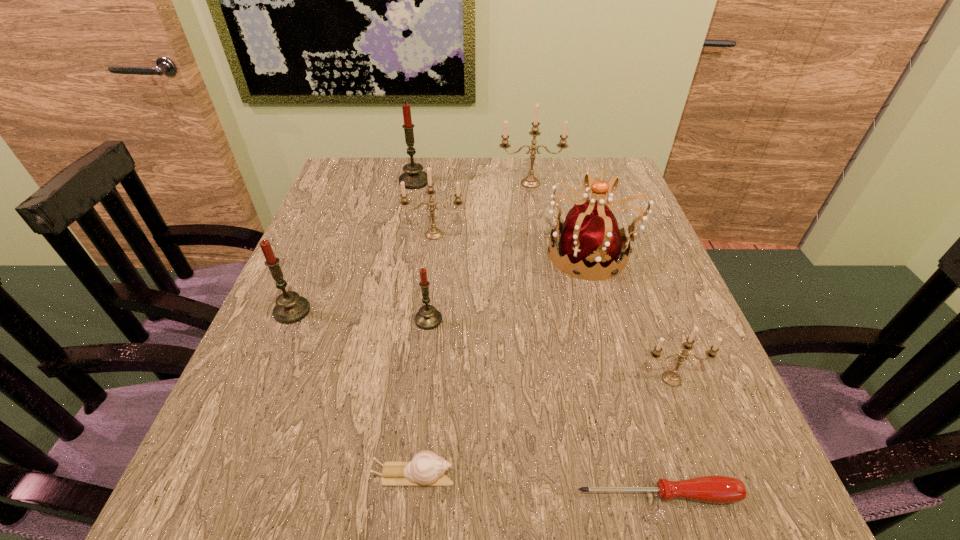
The height and width of the screenshot is (540, 960). In order to click on vacant point located between the seventh farthest object and the second nearest metallic candle in this screenshot , I will do `click(553, 307)`.

Find the location of a particular element. free space between the leftmost red candle and the rightmost candle is located at coordinates (482, 345).

The height and width of the screenshot is (540, 960). What are the coordinates of `vacant region between the shortest object and the nearest candle` in the screenshot? It's located at (664, 437).

Locate an element on the screen. vacant space that's between the screwdriver and the smallest metallic candle is located at coordinates (664, 437).

Find the location of a particular element. unoccupied position between the second farthest metallic candle and the red tiara is located at coordinates (513, 244).

The height and width of the screenshot is (540, 960). What are the coordinates of `free space between the rightmost red candle and the second red candle from right to left` in the screenshot? It's located at (421, 251).

Locate an element on the screen. This screenshot has height=540, width=960. free space between the leftmost red candle and the smallest red candle is located at coordinates (360, 315).

This screenshot has height=540, width=960. Identify the location of blank region between the biggest metallic candle and the biggest red candle. (472, 183).

The width and height of the screenshot is (960, 540). What are the coordinates of `vacant area that lies between the second smallest red candle and the red tiara` in the screenshot? It's located at (442, 282).

Where is `vacant space in between the escargot and the nearest metallic candle`? The image size is (960, 540). vacant space in between the escargot and the nearest metallic candle is located at coordinates (543, 427).